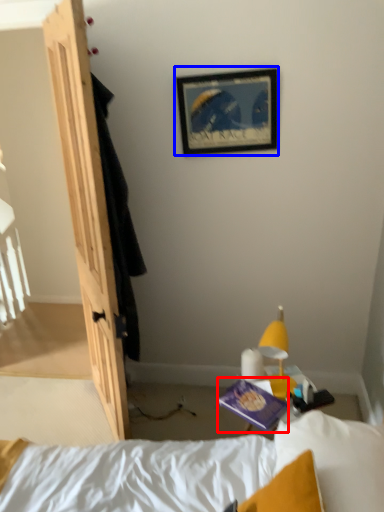
Question: Which point is further to the camera, paperback book (highlighted by a red box) or picture frame (highlighted by a blue box)?

Choices:
 (A) paperback book
 (B) picture frame

Answer: (B)